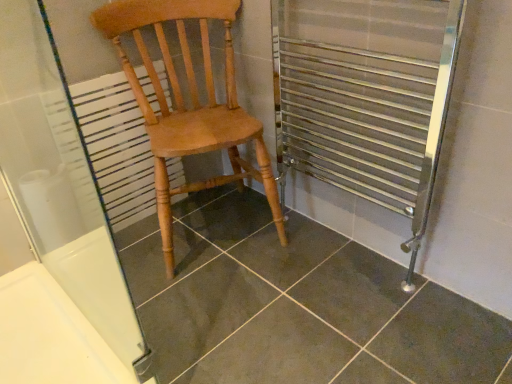
Question: Does dark gray tile at center have a smaller size compared to white textured radiator at left?

Choices:
 (A) no
 (B) yes

Answer: (A)

Question: Considering the relative sizes of dark gray tile at center and white textured radiator at left in the image provided, is dark gray tile at center thinner than white textured radiator at left?

Choices:
 (A) no
 (B) yes

Answer: (A)

Question: Can you confirm if dark gray tile at center is wider than white textured radiator at left?

Choices:
 (A) no
 (B) yes

Answer: (B)

Question: Does dark gray tile at center have a greater height compared to white textured radiator at left?

Choices:
 (A) no
 (B) yes

Answer: (A)

Question: Does dark gray tile at center have a larger size compared to white textured radiator at left?

Choices:
 (A) yes
 (B) no

Answer: (A)

Question: Is dark gray tile at center in front of or behind white textured radiator at left in the image?

Choices:
 (A) behind
 (B) front

Answer: (B)

Question: Would you say dark gray tile at center is to the left or to the right of white textured radiator at left in the picture?

Choices:
 (A) left
 (B) right

Answer: (B)

Question: From a real-world perspective, relative to white textured radiator at left, is dark gray tile at center vertically above or below?

Choices:
 (A) below
 (B) above

Answer: (A)

Question: From the image's perspective, is dark gray tile at center above or below white textured radiator at left?

Choices:
 (A) above
 (B) below

Answer: (B)

Question: In terms of height, does light brown wood chair at center look taller or shorter compared to white textured radiator at left?

Choices:
 (A) short
 (B) tall

Answer: (B)

Question: Is point (102, 28) closer or farther from the camera than point (94, 147)?

Choices:
 (A) farther
 (B) closer

Answer: (B)

Question: Would you say light brown wood chair at center is to the left or to the right of white textured radiator at left in the picture?

Choices:
 (A) right
 (B) left

Answer: (A)

Question: Is light brown wood chair at center wider or thinner than white textured radiator at left?

Choices:
 (A) wide
 (B) thin

Answer: (A)

Question: In terms of width, does light brown wood chair at center look wider or thinner when compared to transparent glass screen door at upper left?

Choices:
 (A) wide
 (B) thin

Answer: (A)

Question: Does point (128, 66) appear closer or farther from the camera than point (39, 91)?

Choices:
 (A) farther
 (B) closer

Answer: (A)